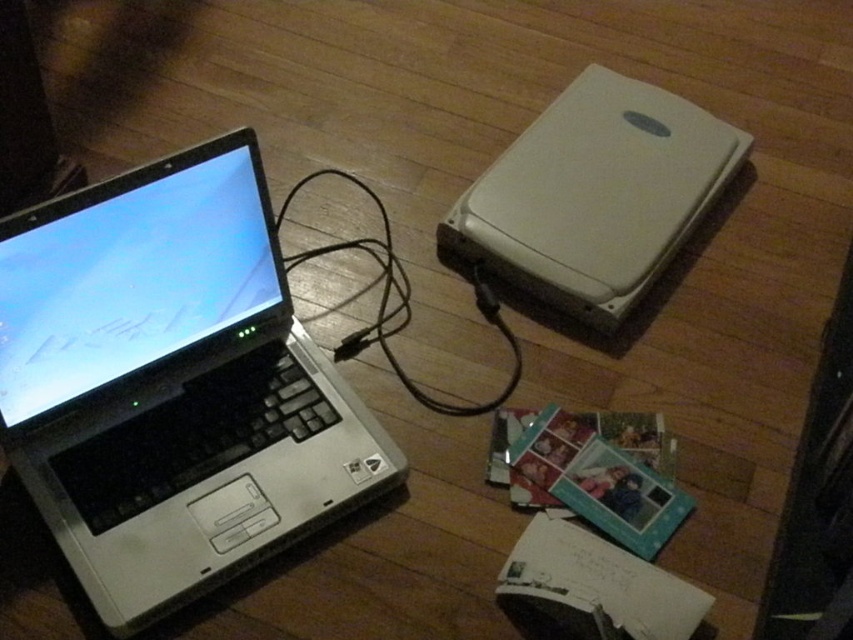
Question: Can you confirm if silver metallic laptop at left is thinner than black cable at center?

Choices:
 (A) no
 (B) yes

Answer: (A)

Question: Which is farther from the black cable at center?

Choices:
 (A) white plastic scanner at center
 (B) silver metallic laptop at left

Answer: (A)

Question: Which of the following is the farthest from the observer?

Choices:
 (A) (624, 225)
 (B) (451, 406)

Answer: (A)

Question: Which object appears farthest from the camera in this image?

Choices:
 (A) white plastic scanner at center
 (B) silver metallic laptop at left
 (C) black cable at center

Answer: (A)

Question: Does white plastic scanner at center appear on the left side of black cable at center?

Choices:
 (A) no
 (B) yes

Answer: (A)

Question: Can you confirm if silver metallic laptop at left is bigger than white plastic scanner at center?

Choices:
 (A) no
 (B) yes

Answer: (B)